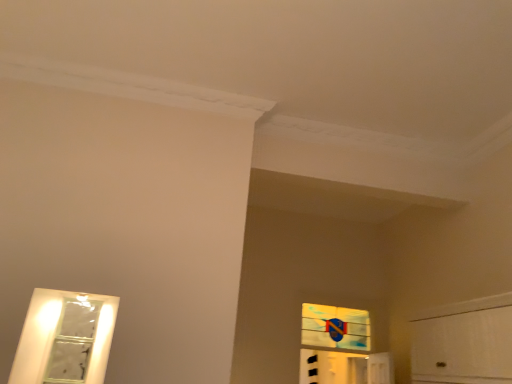
Identify the location of transparent plastic window at upper center. (335, 327).

What do you see at coordinates (335, 327) in the screenshot?
I see `transparent plastic window at upper center` at bounding box center [335, 327].

Identify the location of transparent plastic window at upper center. (335, 327).